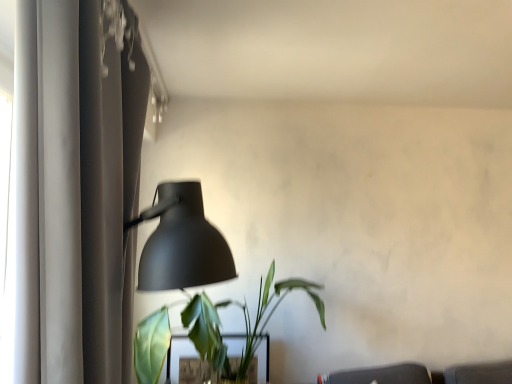
Question: Is matte black lamp at left at the left side of green matte plant at lower center?

Choices:
 (A) no
 (B) yes

Answer: (B)

Question: Can you see matte black lamp at left touching green matte plant at lower center?

Choices:
 (A) yes
 (B) no

Answer: (B)

Question: From the image's perspective, is matte black lamp at left on green matte plant at lower center?

Choices:
 (A) yes
 (B) no

Answer: (A)

Question: Is matte black lamp at left located outside green matte plant at lower center?

Choices:
 (A) yes
 (B) no

Answer: (A)

Question: Considering the relative sizes of matte black lamp at left and green matte plant at lower center in the image provided, is matte black lamp at left shorter than green matte plant at lower center?

Choices:
 (A) yes
 (B) no

Answer: (B)

Question: Is matte black lamp at left at the right side of green matte plant at lower center?

Choices:
 (A) yes
 (B) no

Answer: (B)

Question: Is matte gray curtain at left far away from matte black lamp at left?

Choices:
 (A) no
 (B) yes

Answer: (B)

Question: Can you confirm if matte gray curtain at left is taller than matte black lamp at left?

Choices:
 (A) yes
 (B) no

Answer: (A)

Question: From the image's perspective, is matte gray curtain at left beneath matte black lamp at left?

Choices:
 (A) yes
 (B) no

Answer: (B)

Question: From a real-world perspective, does matte gray curtain at left sit lower than matte black lamp at left?

Choices:
 (A) no
 (B) yes

Answer: (A)

Question: Is matte gray curtain at left wider than matte black lamp at left?

Choices:
 (A) no
 (B) yes

Answer: (A)

Question: Can you confirm if matte gray curtain at left is bigger than matte black lamp at left?

Choices:
 (A) no
 (B) yes

Answer: (B)

Question: Is green matte plant at lower center not within green matte plant at lower center?

Choices:
 (A) no
 (B) yes

Answer: (B)